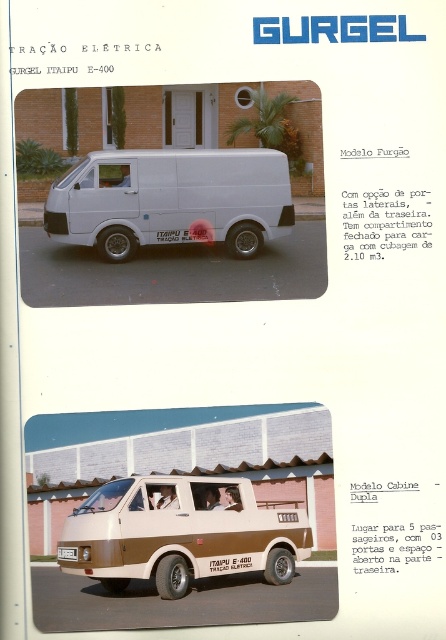
You are looking at a brochure for the Gurgel Itaipu E400 electric van. You notice the white matte van at center and the white plastic license plate at bottom center. Which object is positioned higher in the image?

The white matte van at center is positioned higher than the white plastic license plate at bottom center.